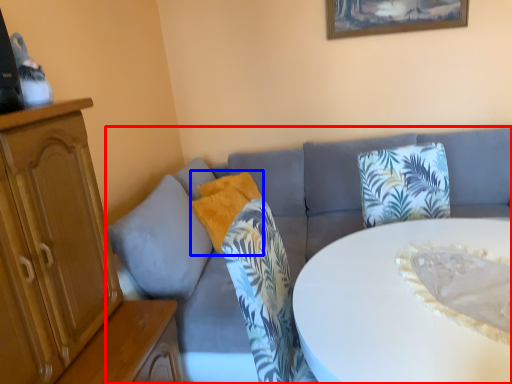
Question: Among these objects, which one is farthest to the camera, studio couch (highlighted by a red box) or pillow (highlighted by a blue box)?

Choices:
 (A) studio couch
 (B) pillow

Answer: (B)